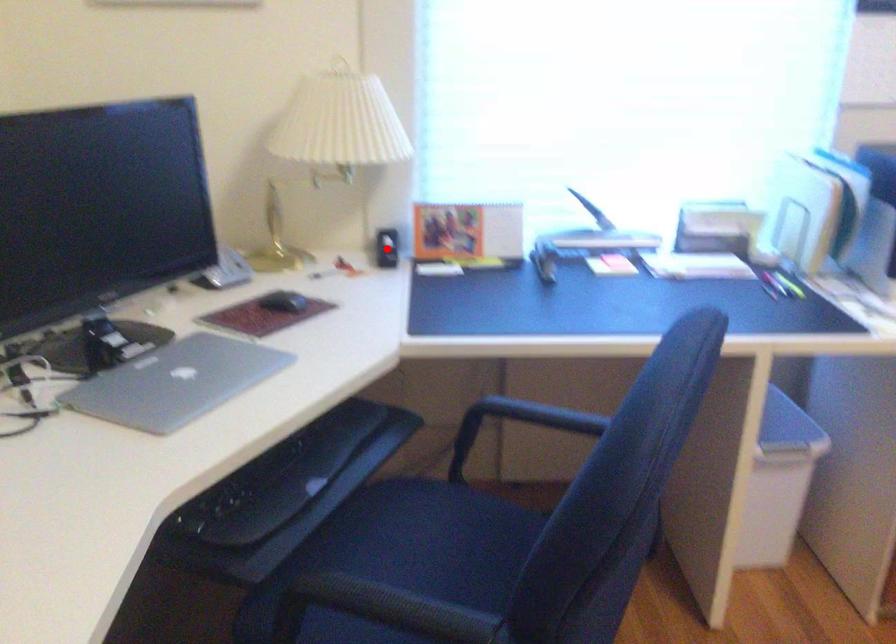
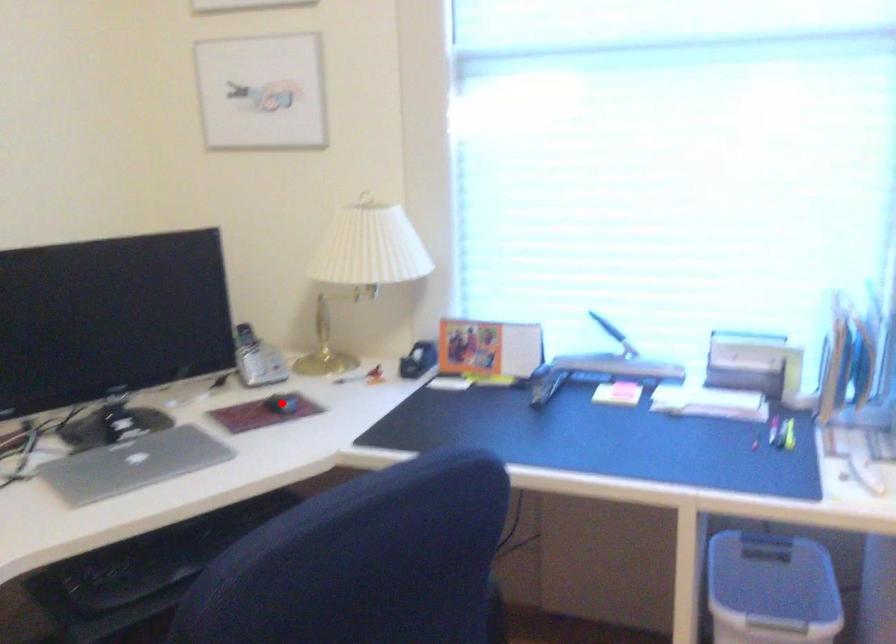
I am providing you with two images of the same scene from different viewpoints. A red point is marked on the first image and another point is marked on the second image. Is the red point in image1 aligned with the point shown in image2?

No